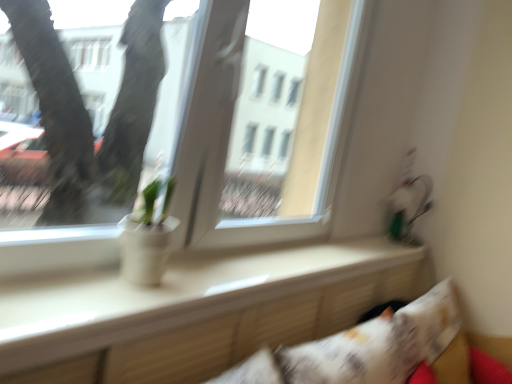
You are a GUI agent. You are given a task and a screenshot of the screen. Output one action in this format:
    pyautogui.click(x=<x>, y=<y>)
    Task: Click on the vacant area to the right of white matte pot at center
    This screenshot has height=384, width=512.
    Given the screenshot: What is the action you would take?
    pyautogui.click(x=202, y=288)